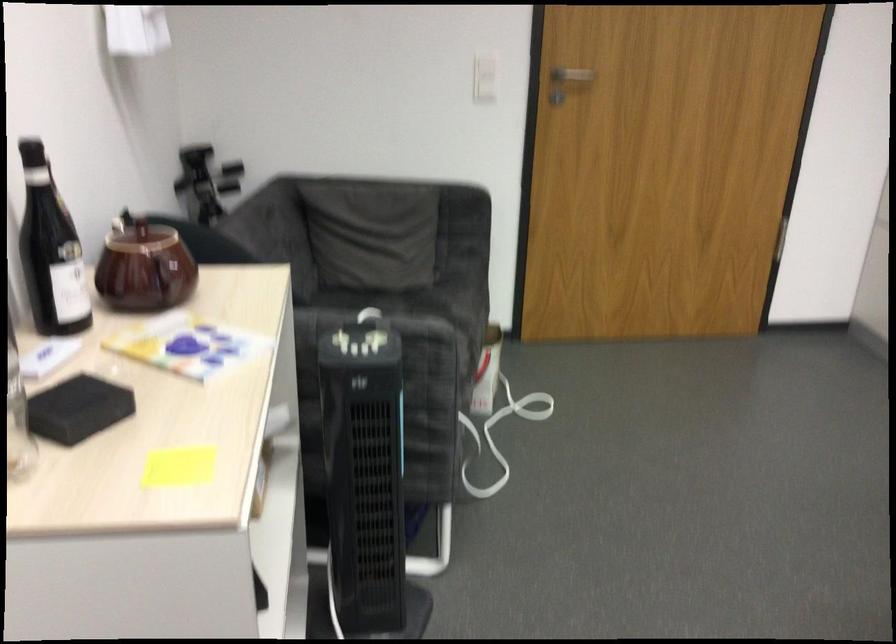
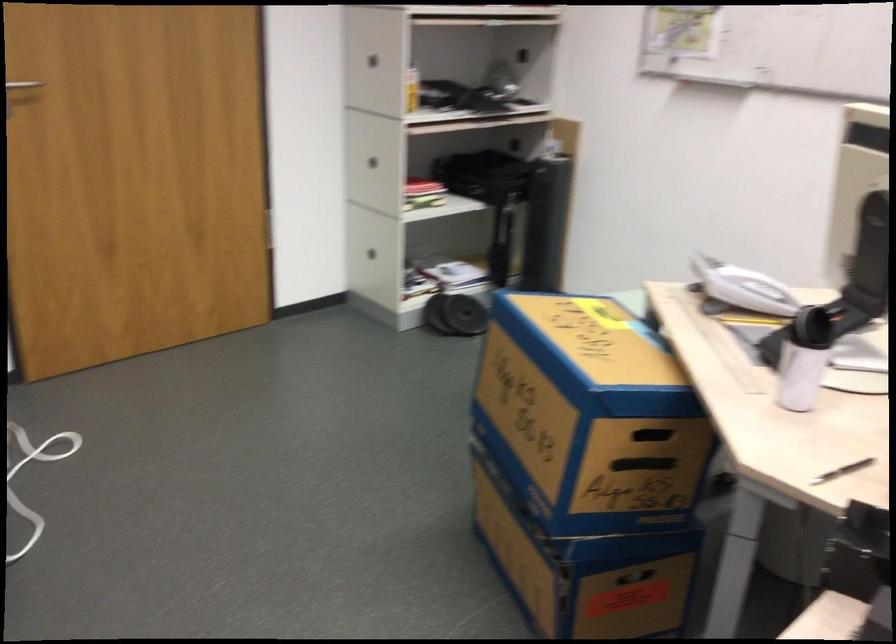
Question: Based on the continuous images, in which direction is the camera rotating? Reply with the corresponding letter.

Choices:
 (A) Left
 (B) Right
 (C) Up
 (D) Down

Answer: (B)